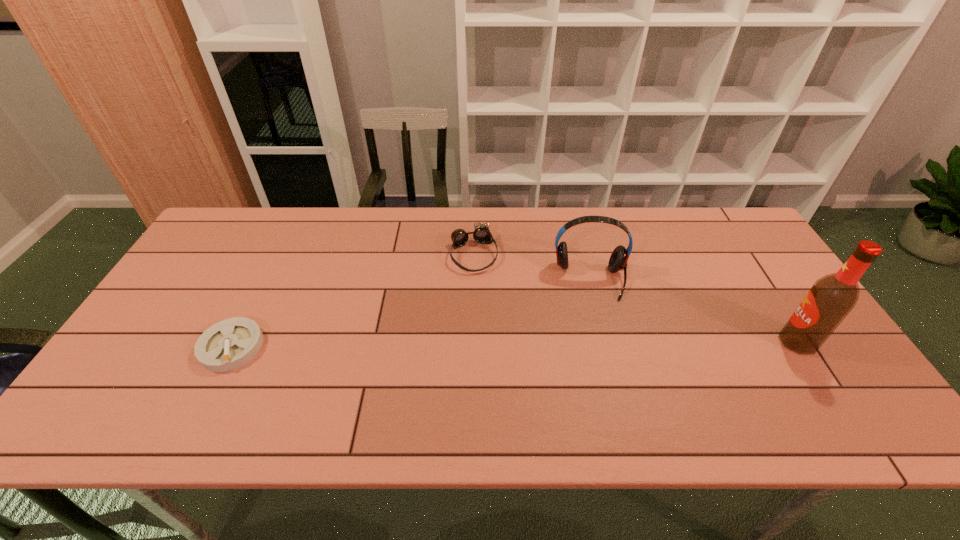
Locate an element on the screen. vacant space on the desktop that is between the shortest object and the rightmost object and is positioned through the lenses of the goggles is located at coordinates (503, 345).

I want to click on vacant space on the desktop that is between the shortest object and the beer bottle and is positioned with the microphone attached to the side of the headset, so click(x=596, y=343).